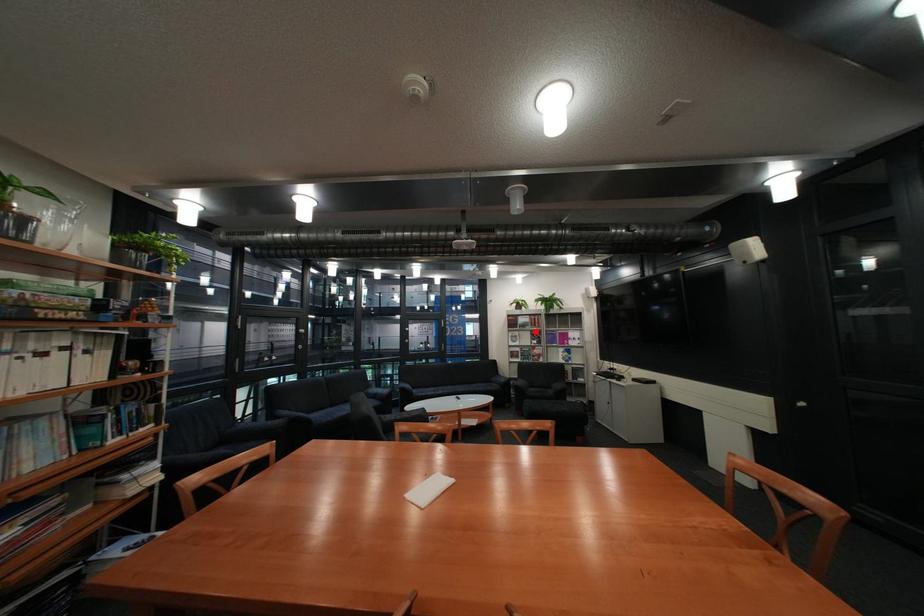
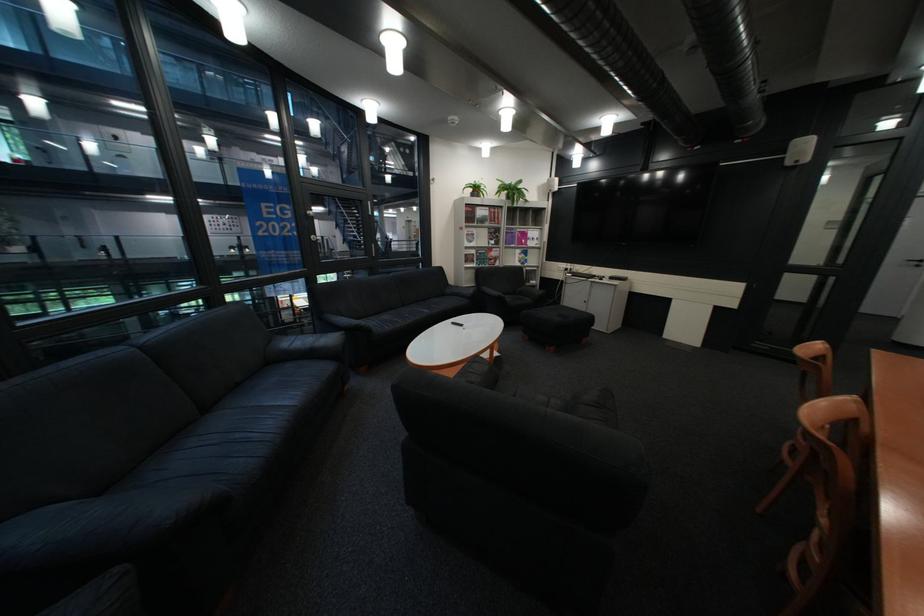
Question: I am providing you with two images of the same scene from different viewpoints. Given a red point in image1, look at the same physical point in image2. Is it:

Choices:
 (A) Closer to the viewpoint
 (B) Farther from the viewpoint

Answer: (A)